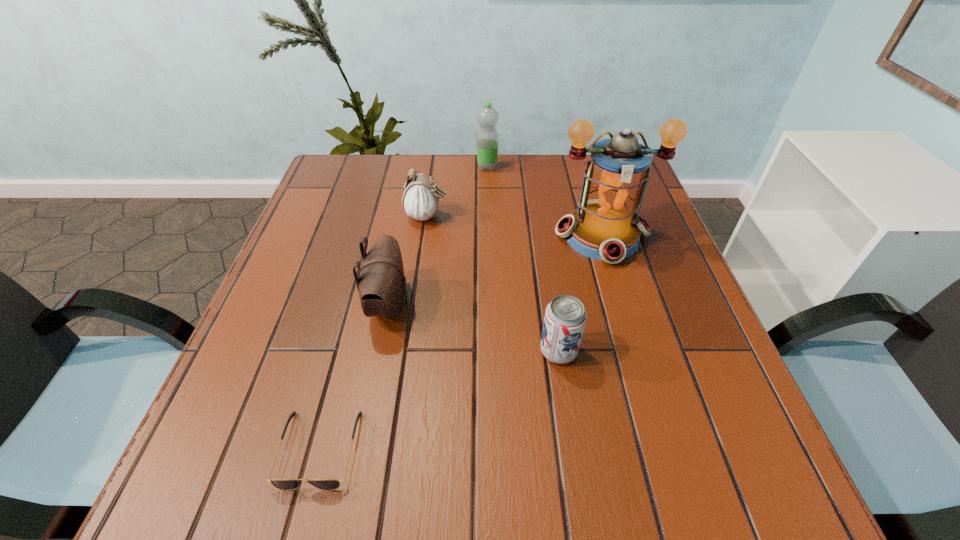
In the image, there is a desktop. At what (x,y) coordinates should I click in order to perform the action: click on blank space at the left edge. Please return your answer as a coordinate pair (x, y). Looking at the image, I should click on (337, 283).

This screenshot has width=960, height=540. In the image, there is a desktop. Find the location of `vacant region at the right edge`. vacant region at the right edge is located at coordinates (670, 251).

Locate an element on the screen. The image size is (960, 540). blank space at the far left corner of the desktop is located at coordinates (317, 201).

The height and width of the screenshot is (540, 960). Identify the location of free space at the near left corner of the desktop. (195, 504).

Locate an element on the screen. Image resolution: width=960 pixels, height=540 pixels. empty location between the nearer pouch and the farther pouch is located at coordinates (408, 260).

Where is `empty space between the beer can and the nearer pouch`? This screenshot has width=960, height=540. empty space between the beer can and the nearer pouch is located at coordinates (473, 328).

Identify the location of vacant region between the beer can and the third object from right to left. This screenshot has width=960, height=540. (523, 259).

Locate an element on the screen. vacant space that's between the farther pouch and the nearest object is located at coordinates (373, 333).

Locate an element on the screen. The height and width of the screenshot is (540, 960). free spot between the nearest object and the fifth shortest object is located at coordinates (403, 308).

Identify the location of vacant area that lies between the fourth object from left to right and the farther pouch. (458, 192).